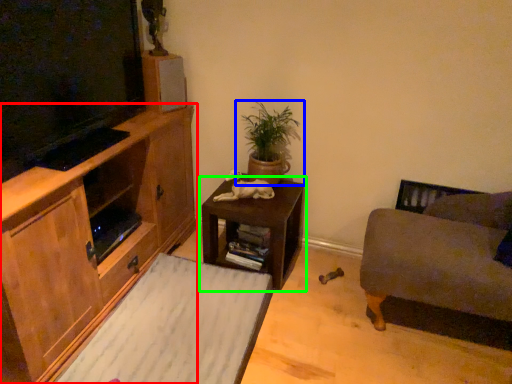
Question: Estimate the real-world distances between objects in this image. Which object is closer to cabinetry (highlighted by a red box), houseplant (highlighted by a blue box) or table (highlighted by a green box)?

Choices:
 (A) houseplant
 (B) table

Answer: (B)